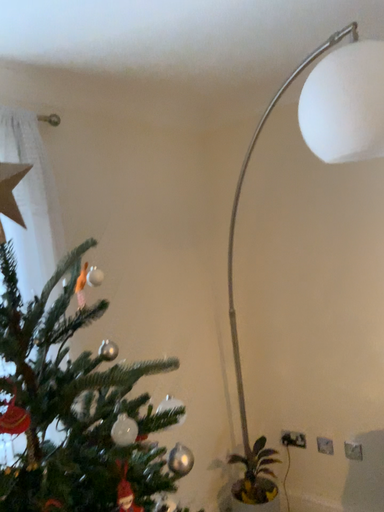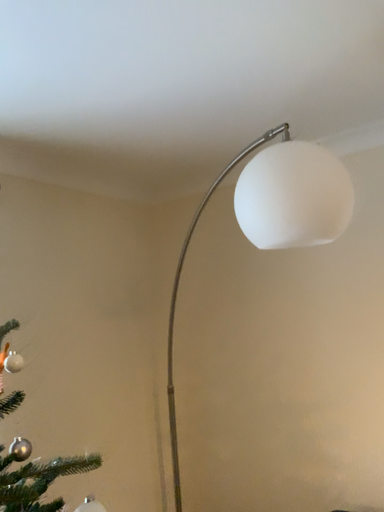
Question: How did the camera likely rotate when shooting the video?

Choices:
 (A) rotated downward
 (B) rotated upward

Answer: (B)